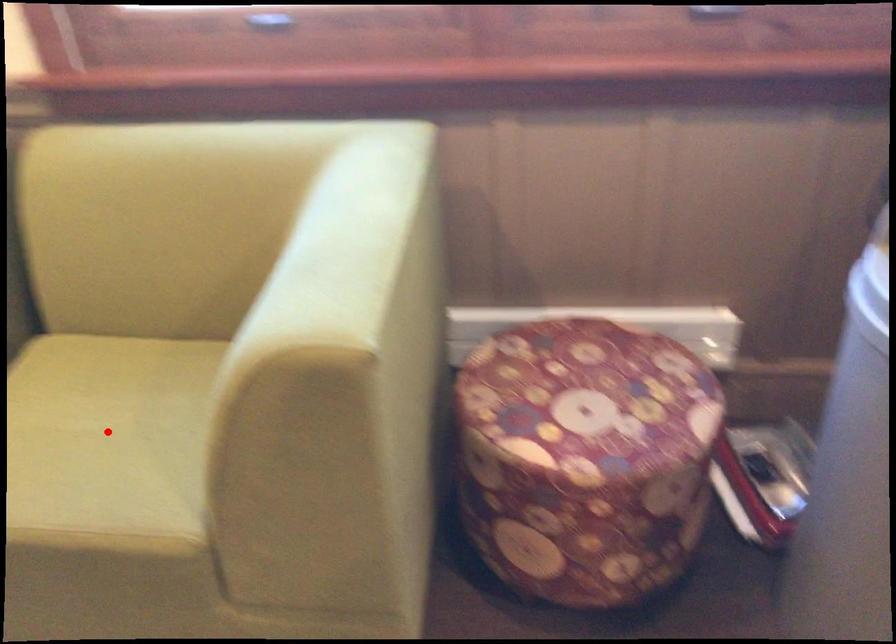
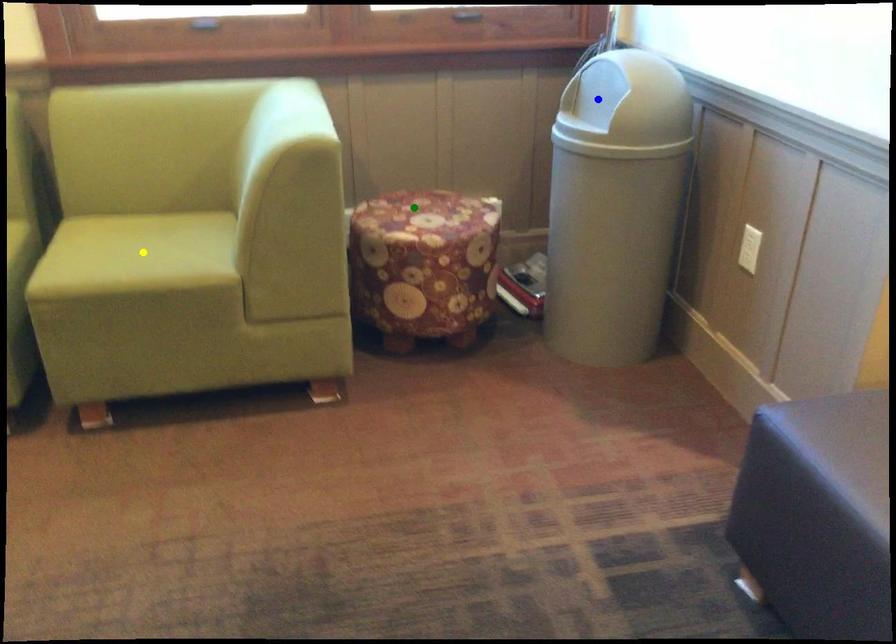
Question: I am providing you with two images of the same scene from different viewpoints. A red point is marked on the first image. You are given multiple points on the second image. Which point in image 2 represents the same 3d spot as the red point in image 1?

Choices:
 (A) green point
 (B) yellow point
 (C) blue point

Answer: (B)